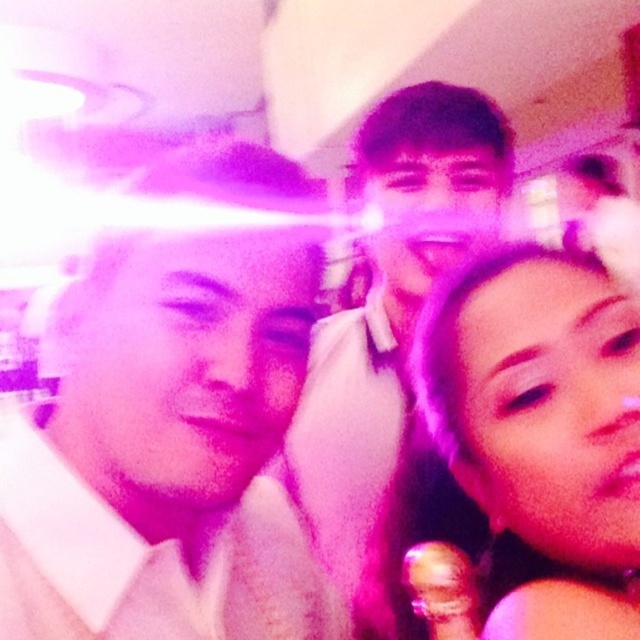
Can you confirm if matte white shirt at left is wider than matte white shirt at center?

No, matte white shirt at left is not wider than matte white shirt at center.

Is matte white shirt at left taller than matte white shirt at center?

Incorrect, matte white shirt at left's height is not larger of matte white shirt at center's.

Between point (76, 538) and point (492, 129), which one is positioned in front?

Point (76, 538) is in front.

Identify the location of matte white shirt at left. (168, 452).

Is matte pink hair at center to the right of matte white shirt at center from the viewer's perspective?

Correct, you'll find matte pink hair at center to the right of matte white shirt at center.

Is point (628, 314) closer to camera compared to point (392, 433)?

Yes, point (628, 314) is in front of point (392, 433).

Locate an element on the screen. matte pink hair at center is located at coordinates (538, 410).

Between matte white shirt at left and matte pink hair at center, which one has less height?

With less height is matte pink hair at center.

Does point (154, 250) come in front of point (467, 371)?

Yes.

Does point (170, 497) come closer to viewer compared to point (620, 502)?

No, (170, 497) is behind (620, 502).

This screenshot has height=640, width=640. I want to click on matte white shirt at left, so click(168, 452).